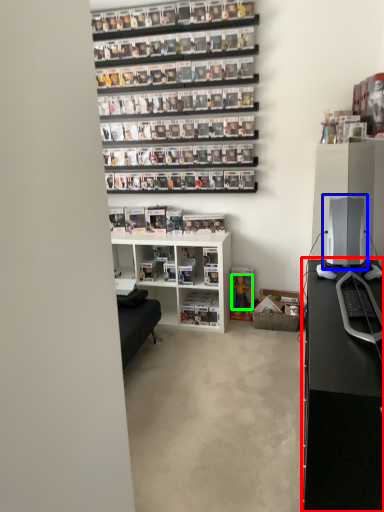
Question: Which is nearer to the desk (highlighted by a red box)? desktop computer (highlighted by a blue box) or toy (highlighted by a green box).

Choices:
 (A) desktop computer
 (B) toy

Answer: (A)